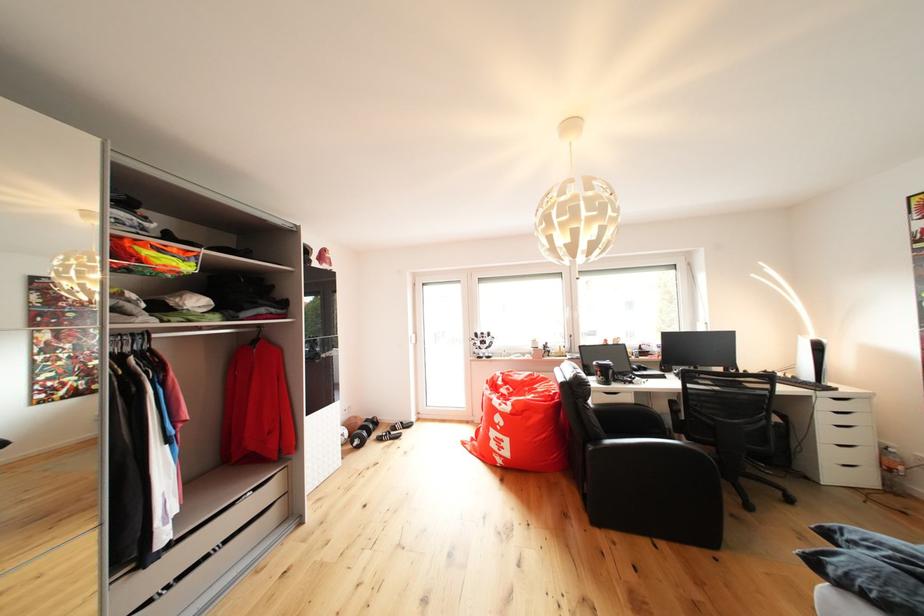
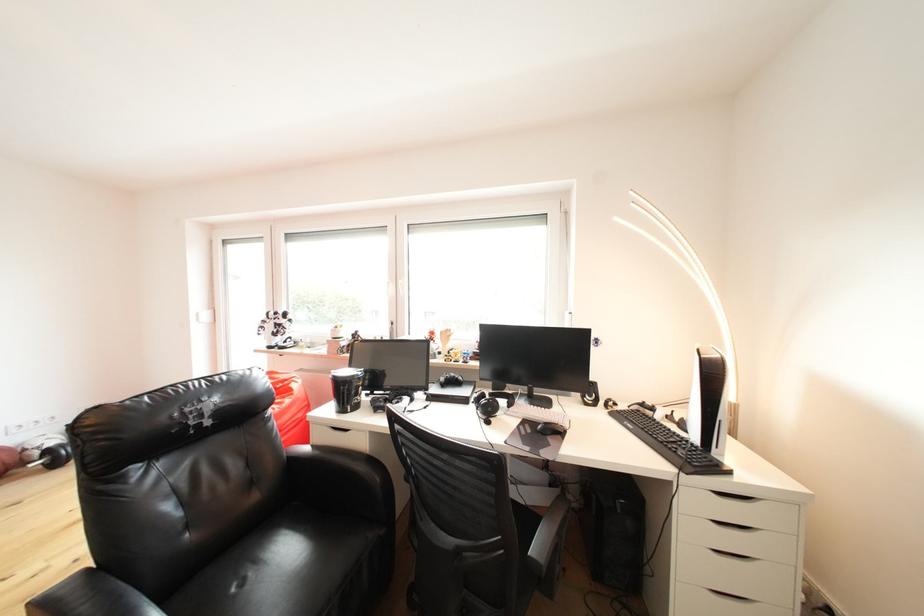
Based on the photo, what movement of the cameraman would produce the second image?

The movement direction of the cameraman is right, forward.